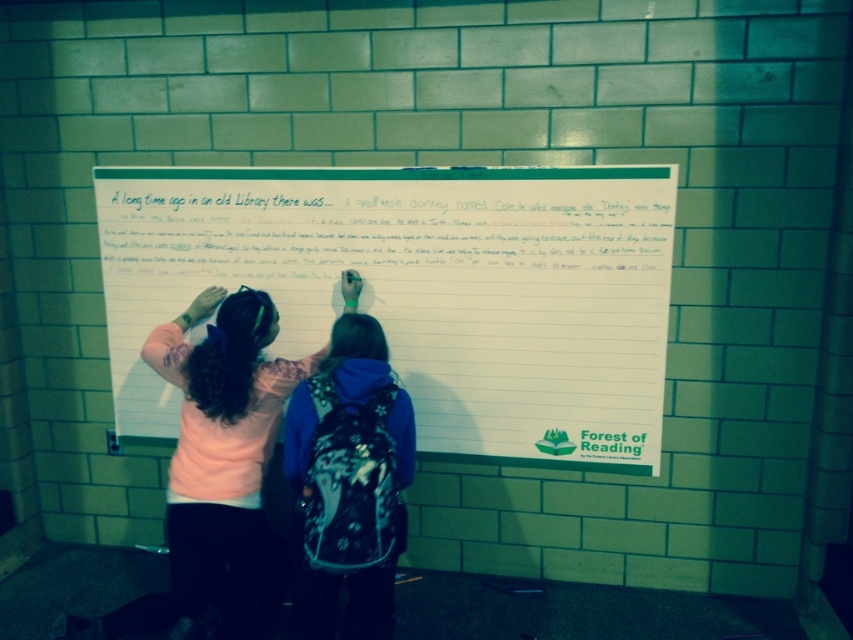
Measure the distance between point (572, 449) and camera.

Point (572, 449) and camera are 2.92 meters apart from each other.

Does white paper at center appear under floral-patterned backpack at center?

No.

At what (x,y) coordinates should I click in order to perform the action: click on white paper at center. Please return your answer as a coordinate pair (x, y). Image resolution: width=853 pixels, height=640 pixels. Looking at the image, I should click on (421, 291).

Locate an element on the screen. white paper at center is located at coordinates (421, 291).

In the scene shown: Can you confirm if light pink sweater at center is taller than floral-patterned backpack at center?

Yes.

Measure the distance from light pink sweater at center to floral-patterned backpack at center.

light pink sweater at center is 12.84 inches away from floral-patterned backpack at center.

Find the location of a particular element. The image size is (853, 640). light pink sweater at center is located at coordinates (222, 442).

Is white paper at center below light pink sweater at center?

No.

Can you confirm if white paper at center is thinner than light pink sweater at center?

No, white paper at center is not thinner than light pink sweater at center.

Image resolution: width=853 pixels, height=640 pixels. I want to click on white paper at center, so click(421, 291).